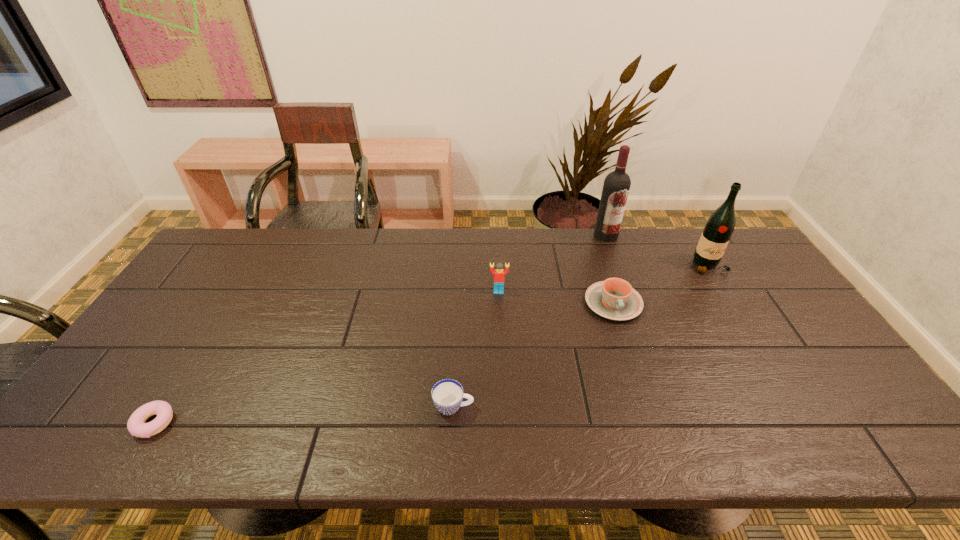
Find the location of a particular element. Image resolution: width=960 pixels, height=540 pixels. empty space that is in between the third object from left to right and the left wine bottle is located at coordinates (552, 263).

The image size is (960, 540). Identify the location of vacant space that's between the Lego and the right wine bottle. (604, 279).

Identify the location of vacant region between the fourth shortest object and the farthest object. Image resolution: width=960 pixels, height=540 pixels. (552, 263).

Image resolution: width=960 pixels, height=540 pixels. I want to click on free space between the shortest object and the left wine bottle, so click(x=380, y=329).

Find the location of `vacant area that lies between the second object from left to right and the leftmost object`. vacant area that lies between the second object from left to right and the leftmost object is located at coordinates (303, 415).

This screenshot has height=540, width=960. Find the location of `blank region between the cup and the third tallest object`. blank region between the cup and the third tallest object is located at coordinates (476, 349).

I want to click on free space between the farthest object and the doughnut, so click(380, 329).

You are a GUI agent. You are given a task and a screenshot of the screen. Output one action in this format:
    pyautogui.click(x=<x>, y=<y>)
    Task: Click on the vacant space that's between the third tallest object and the shortest object
    This screenshot has height=540, width=960.
    Given the screenshot: What is the action you would take?
    pyautogui.click(x=326, y=357)

Choose which object is the fifth nearest neighbor to the fourth object from right to left. Please provide its 2D coordinates. Your answer should be formatted as a tuple, i.e. [(x, y)], where the tuple contains the x and y coordinates of a point satisfying the conditions above.

[(136, 425)]

Locate which object ranks second in proximity to the chinaware. Please provide its 2D coordinates. Your answer should be formatted as a tuple, i.e. [(x, y)], where the tuple contains the x and y coordinates of a point satisfying the conditions above.

[(617, 183)]